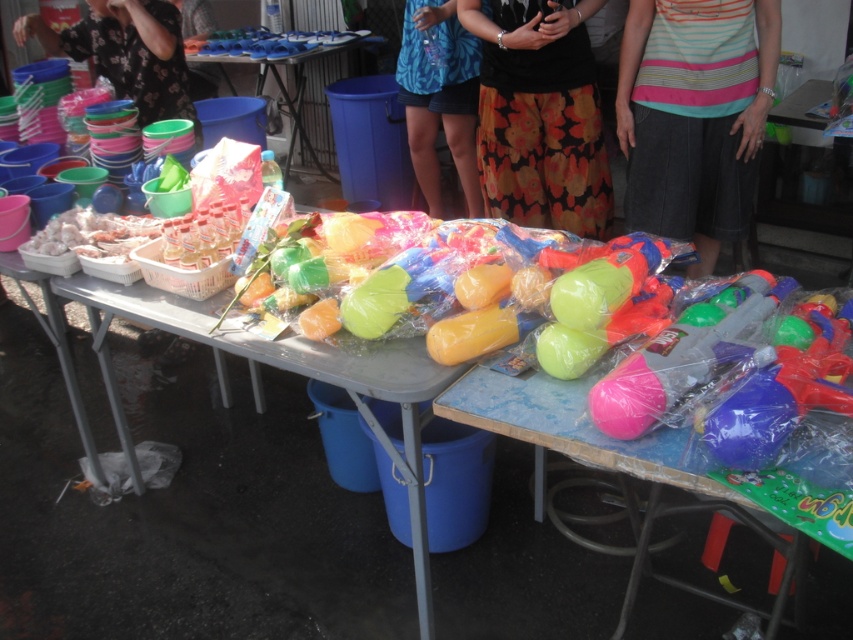
Question: Among these points, which one is nearest to the camera?

Choices:
 (A) tap(202, 51)
 (B) tap(642, 28)

Answer: (B)

Question: Which point is farther to the camera?

Choices:
 (A) floral skirt at center
 (B) striped fabric skirt at center
 (C) blue floral shirt at upper center

Answer: (C)

Question: Is blue plastic buckets at upper left bigger than translucent plastic toys at center?

Choices:
 (A) yes
 (B) no

Answer: (A)

Question: Which of the following is the closest to the observer?

Choices:
 (A) (534, 467)
 (B) (409, 134)
 (C) (349, 38)
 (D) (79, 32)

Answer: (A)

Question: Can you confirm if floral skirt at center is positioned above brushed metal buckets at upper left?

Choices:
 (A) yes
 (B) no

Answer: (B)

Question: Does floral skirt at center have a greater width compared to blue floral shirt at upper center?

Choices:
 (A) yes
 (B) no

Answer: (A)